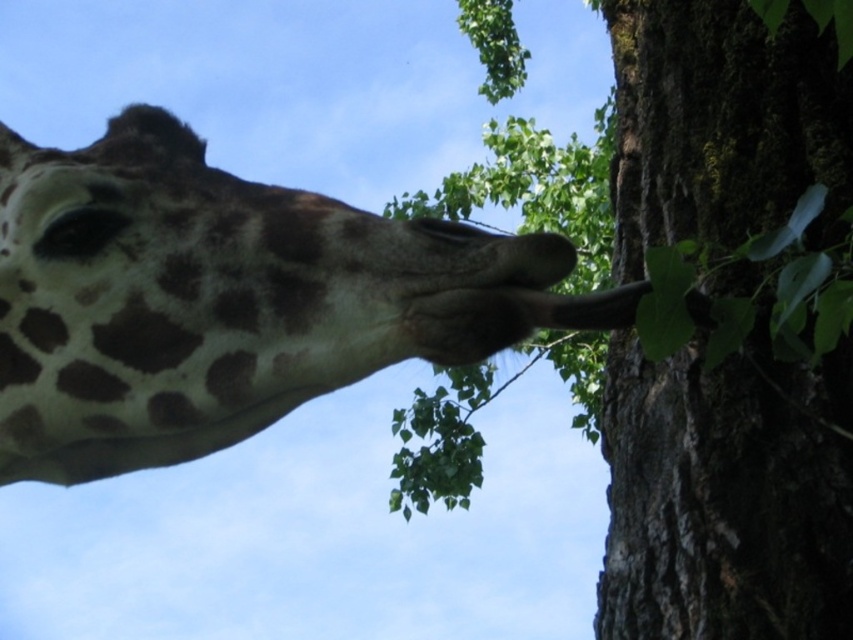
You are a photographer trying to capture the giraffe in the image. You notice a specific point at coordinates point (213, 300). Where exactly on the giraffe would this point be located?

The point (213, 300) is located on the spotted fur at upper left of the giraffe.

You are standing in front of a giraffe and want to touch the point at coordinates point (190,371) on its body. If your hand can reach up to 5 feet, will you be able to reach that point?

The point (190,371) is 5.64 feet away from the viewer. Since your hand can only reach up to 5 feet, you will not be able to reach that point.

The spotted fur at upper left is part of which animal? Please answer based on the scene description.

The spotted fur at upper left is part of the giraffe.